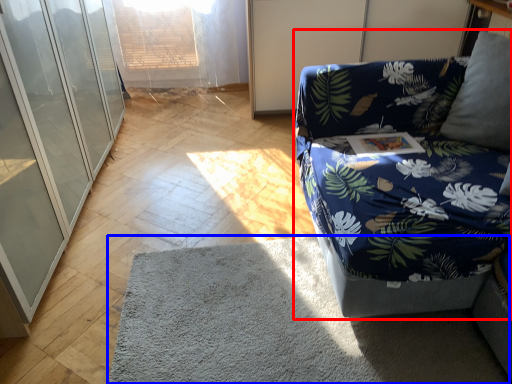
Question: Which object appears closest to the camera in this image, studio couch (highlighted by a red box) or mat (highlighted by a blue box)?

Choices:
 (A) studio couch
 (B) mat

Answer: (A)